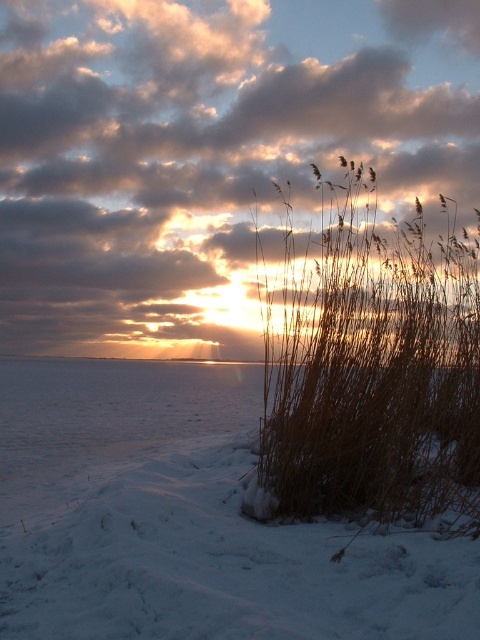
Can you confirm if white fluffy snow at lower left is wider than dry grass at center?

Yes, white fluffy snow at lower left is wider than dry grass at center.

What do you see at coordinates (187, 522) in the screenshot?
I see `white fluffy snow at lower left` at bounding box center [187, 522].

Find the location of a particular element. white fluffy snow at lower left is located at coordinates (187, 522).

You are a GUI agent. You are given a task and a screenshot of the screen. Output one action in this format:
    pyautogui.click(x=<x>, y=<y>)
    Task: Click on the white fluffy snow at lower left
    This screenshot has height=640, width=480.
    Given the screenshot: What is the action you would take?
    pyautogui.click(x=187, y=522)

Can you confirm if cloudy sky at upper center is positioned to the left of white fluffy snow at lower left?

Incorrect, cloudy sky at upper center is not on the left side of white fluffy snow at lower left.

Between cloudy sky at upper center and white fluffy snow at lower left, which one has less height?

white fluffy snow at lower left

Image resolution: width=480 pixels, height=640 pixels. Describe the element at coordinates (202, 147) in the screenshot. I see `cloudy sky at upper center` at that location.

Where is `cloudy sky at upper center`? This screenshot has height=640, width=480. cloudy sky at upper center is located at coordinates (202, 147).

What do you see at coordinates (202, 147) in the screenshot? I see `cloudy sky at upper center` at bounding box center [202, 147].

Identify the location of cloudy sky at upper center. The width and height of the screenshot is (480, 640). (202, 147).

You are a GUI agent. You are given a task and a screenshot of the screen. Output one action in this format:
    pyautogui.click(x=<x>, y=<y>)
    Task: Click on the cloudy sky at upper center
    The width and height of the screenshot is (480, 640).
    Given the screenshot: What is the action you would take?
    pyautogui.click(x=202, y=147)

In order to click on cloudy sky at upper center in this screenshot , I will do `click(202, 147)`.